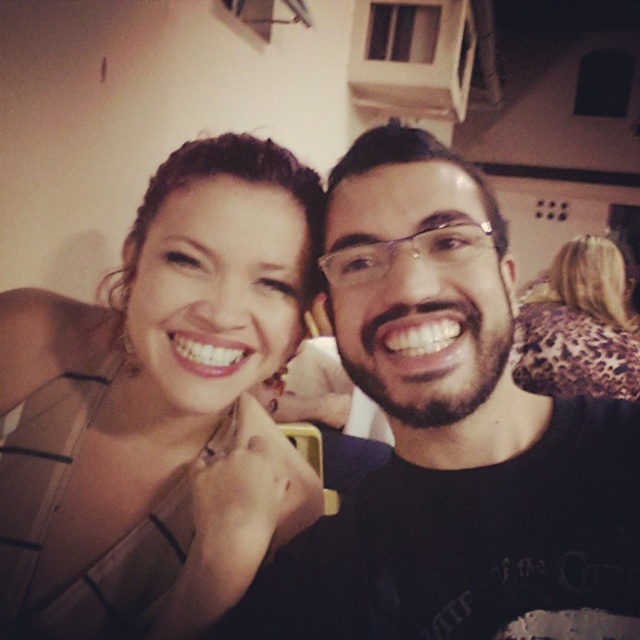
Question: Is satin beige dress at upper left positioned at the back of leopard print scarf at upper right?

Choices:
 (A) yes
 (B) no

Answer: (B)

Question: Does satin beige dress at upper left appear over black matte shirt at center?

Choices:
 (A) no
 (B) yes

Answer: (B)

Question: Which object is closer to the camera taking this photo?

Choices:
 (A) black matte shirt at center
 (B) leopard print scarf at upper right

Answer: (A)

Question: Which point is closer to the camera?

Choices:
 (A) leopard print scarf at upper right
 (B) satin beige dress at upper left
 (C) black matte shirt at center

Answer: (C)

Question: Can you confirm if satin beige dress at upper left is positioned above black matte shirt at center?

Choices:
 (A) no
 (B) yes

Answer: (B)

Question: Which of the following is the closest to the observer?

Choices:
 (A) leopard print scarf at upper right
 (B) black matte shirt at center
 (C) satin beige dress at upper left

Answer: (B)